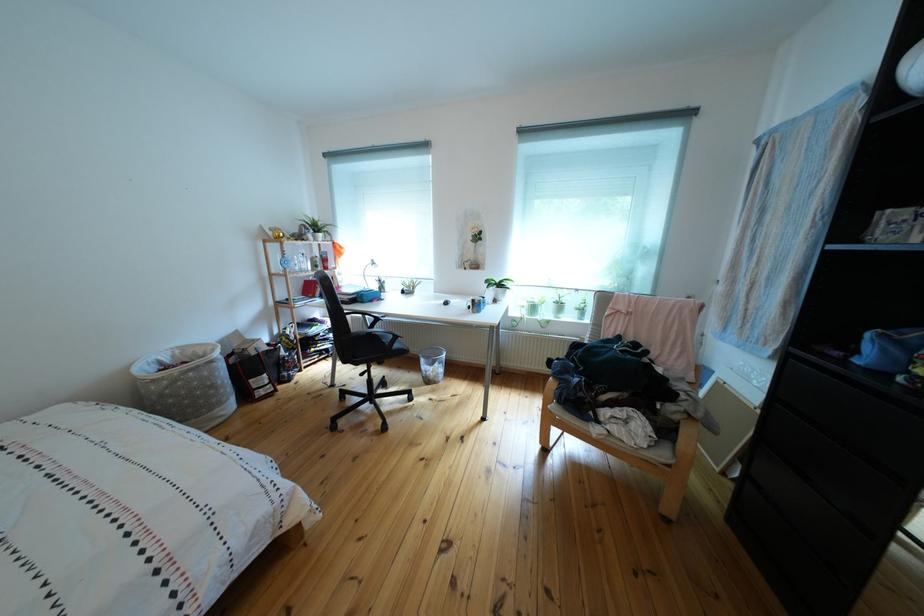
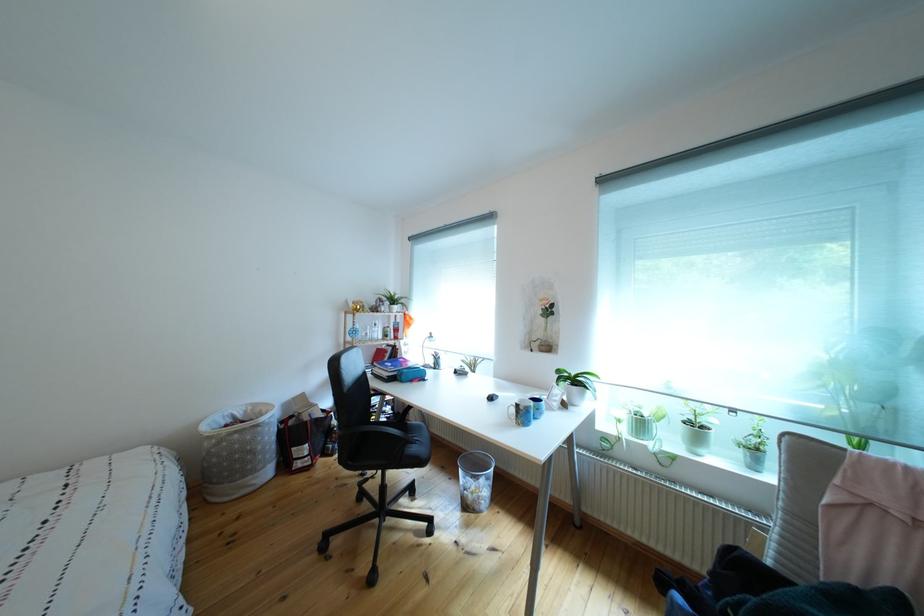
The images are taken continuously from a first-person perspective. In which direction are you moving?

The cameraman walked toward right, forward.